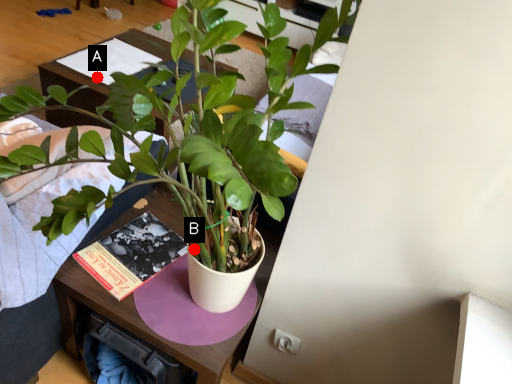
Question: Two points are circled on the image, labeled by A and B beside each circle. Among these points, which one is nearest to the camera?

Choices:
 (A) A is closer
 (B) B is closer

Answer: (B)